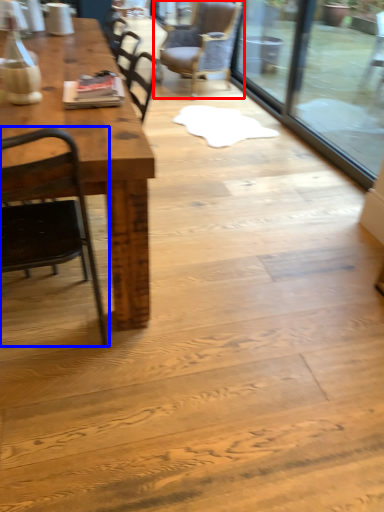
Question: Which point is further to the camera, chair (highlighted by a red box) or chair (highlighted by a blue box)?

Choices:
 (A) chair
 (B) chair

Answer: (A)